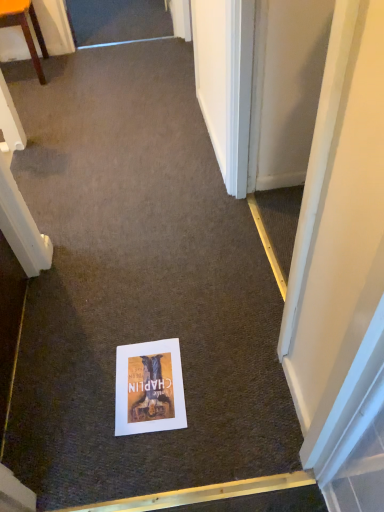
What are the coordinates of `free space above matte paper poster at center (from a real-world perspective)` in the screenshot? It's located at (148, 384).